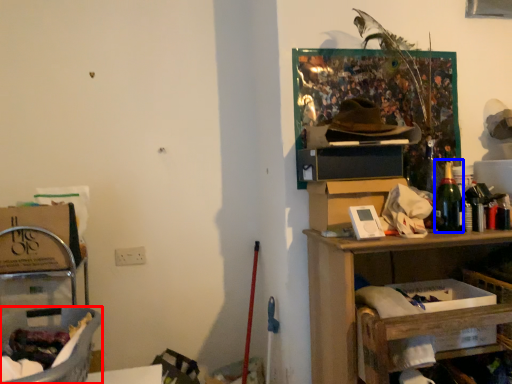
Question: Which object is further to the camera taking this photo, laundry basket (highlighted by a red box) or bottle (highlighted by a blue box)?

Choices:
 (A) laundry basket
 (B) bottle

Answer: (B)